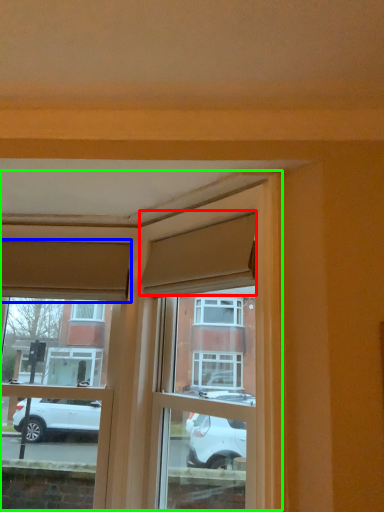
Question: Based on their relative distances, which object is nearer to curtain (highlighted by a red box)? Choose from curtain (highlighted by a blue box) and window frame (highlighted by a green box).

Choices:
 (A) curtain
 (B) window frame

Answer: (B)